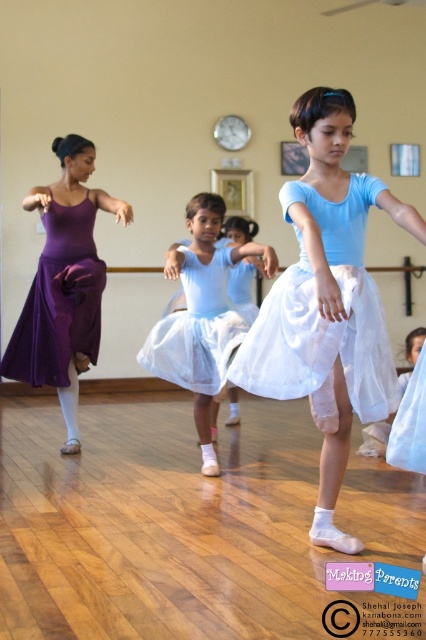
You are a photographer adjusting your camera settings to capture the ballet class. You notice two specific points in the scene marked as point (307, 189) and point (206, 323). Which point is nearer to your camera lens?

Point (307, 189) is closer to the camera than point (206, 323).

Based on the scene description, which object is taller between the light blue satin tutu at center and the purple satin skirt at left?

The light blue satin tutu at center is taller than the purple satin skirt at left according to the description.

In the ballet class scene, there are two dancers wearing different colored skirts. The white satin ballet skirt at center and the purple satin skirt at left. Which dancer is positioned to the right of the other?

The white satin ballet skirt at center is positioned to the right of the purple satin skirt at left.